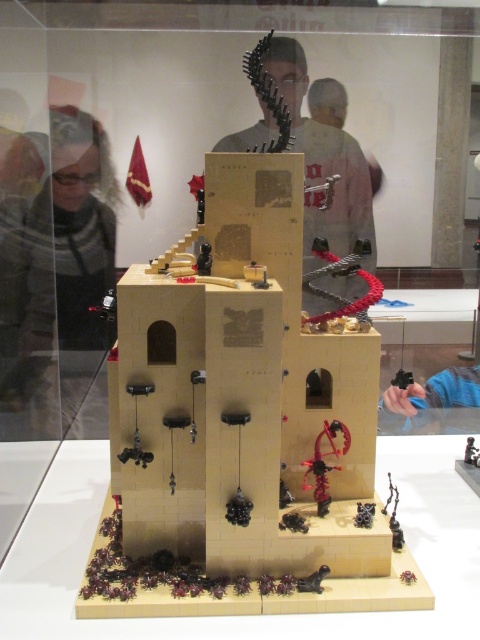
You are an artist who wants to place a new sculpture in the museum display. You have a small sculpture that is the same size as the matte gray sweater at left. Can you fit it next to the matte black sculpture at center without overlapping?

The matte gray sweater at left is smaller than the matte black sculpture at center, so the new sculpture, being the same size as the sweater, should fit next to the larger sculpture without overlapping, provided there is enough space in the display area.

You are an art curator planning to move the matte gray sweater at left and the matte black sculpture at center to a new exhibition space. If you need to ensure both items fit side by side on a shelf that is 1.2 meters wide, will they fit based on their widths?

The matte gray sweater at left has a lesser width compared to the matte black sculpture at center. Since the total width of both items combined would be less than 1.2 meters, they can fit side by side on the shelf.